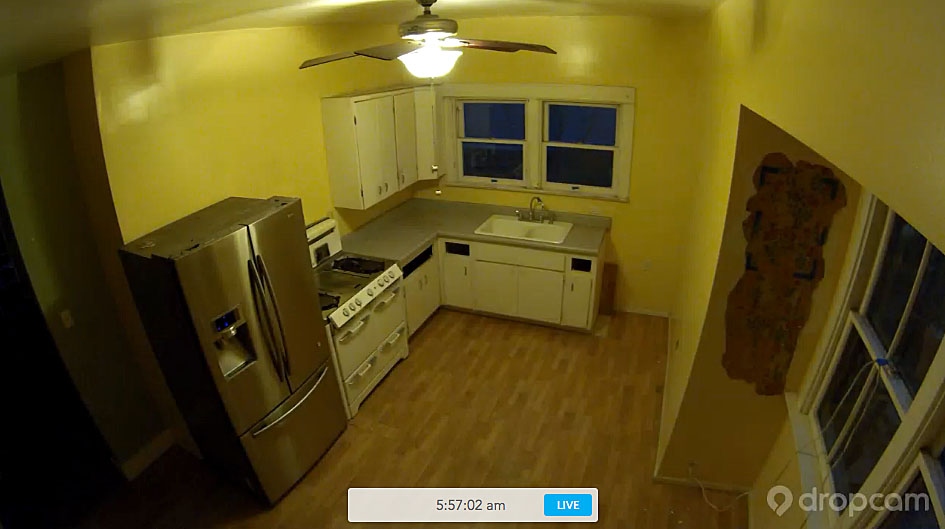
Locate an element on the screen. Image resolution: width=945 pixels, height=529 pixels. water dispenser on fridge is located at coordinates (224, 323).